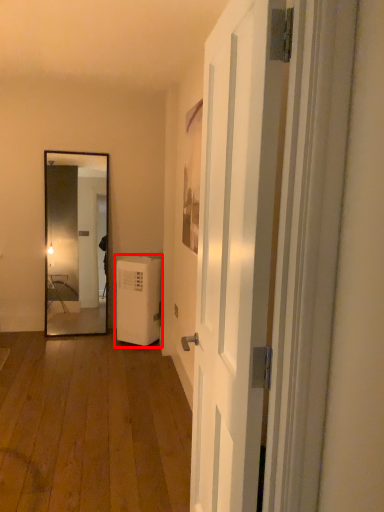
Question: Where is water heater (annotated by the red box) located in relation to door in the image?

Choices:
 (A) right
 (B) left

Answer: (B)